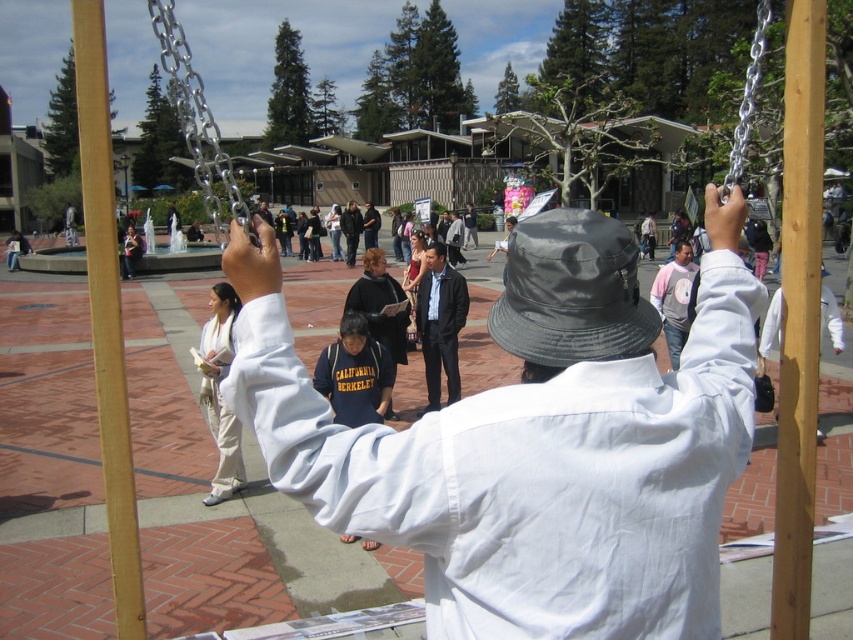
Is point (421, 464) farther from viewer compared to point (343, 540)?

No, it is not.

Which is above, white matte shirt at center or dark blue fleece jacket at center?

white matte shirt at center is above.

I want to click on white matte shirt at center, so click(535, 442).

Does dark blue suit at center appear on the left side of dark gray jacket at center?

No, dark blue suit at center is not to the left of dark gray jacket at center.

Does dark blue suit at center have a greater height compared to dark gray jacket at center?

Incorrect, dark blue suit at center's height is not larger of dark gray jacket at center's.

Is point (433, 397) less distant than point (343, 216)?

Yes.

At what (x,y) coordinates should I click in order to perform the action: click on dark blue suit at center. Please return your answer as a coordinate pair (x, y). Looking at the image, I should click on (439, 321).

Between point (355, 232) and point (457, 236), which one is positioned in front?

Positioned in front is point (457, 236).

Is dark gray jacket at center to the right of dark gray fabric jacket at center from the viewer's perspective?

Incorrect, dark gray jacket at center is not on the right side of dark gray fabric jacket at center.

Between point (354, 237) and point (453, 237), which one is positioned behind?

Positioned behind is point (354, 237).

This screenshot has width=853, height=640. What are the coordinates of `dark gray jacket at center` in the screenshot? It's located at 351,230.